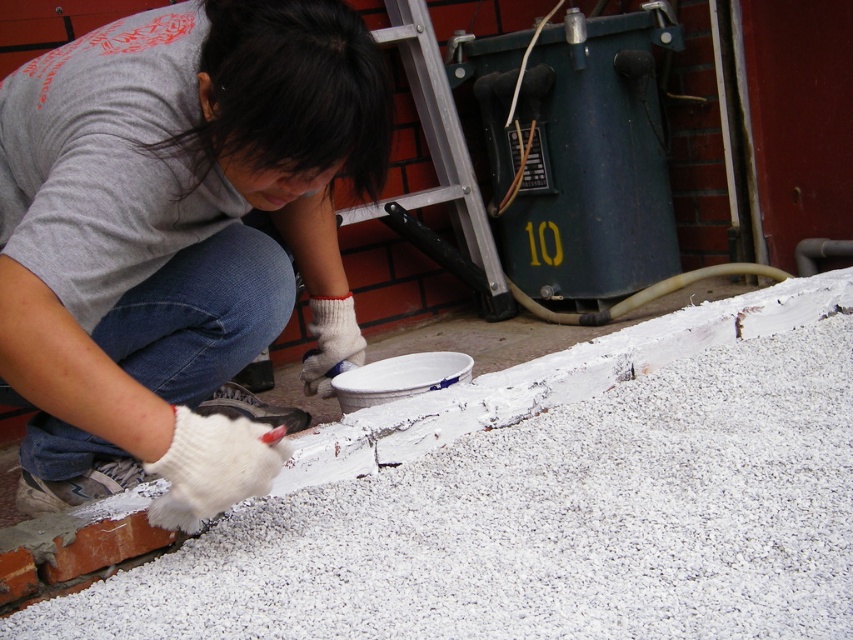
Question: Which of the following is the farthest from the observer?

Choices:
 (A) (840, 362)
 (B) (22, 502)

Answer: (A)

Question: Which of the following is the farthest from the observer?

Choices:
 (A) brushed metal ladder at upper center
 (B) white granular gravel at center
 (C) white matte paintbrush at lower center

Answer: (A)

Question: In this image, where is white granular gravel at center located relative to brushed metal ladder at upper center?

Choices:
 (A) left
 (B) right

Answer: (B)

Question: Can you confirm if white granular gravel at center is bigger than brushed metal ladder at upper center?

Choices:
 (A) yes
 (B) no

Answer: (A)

Question: Does white granular gravel at center have a smaller size compared to brushed metal ladder at upper center?

Choices:
 (A) yes
 (B) no

Answer: (B)

Question: Which point appears closest to the camera in this image?

Choices:
 (A) (83, 372)
 (B) (494, 253)
 (C) (848, 291)

Answer: (A)